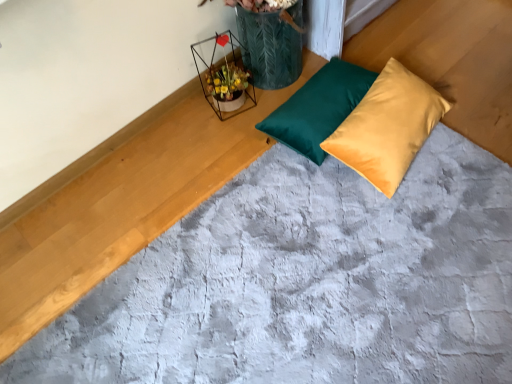
Where is `teal satin pillow at center, marked as the first pillow in a left-to-right arrangement`? This screenshot has width=512, height=384. teal satin pillow at center, marked as the first pillow in a left-to-right arrangement is located at coordinates (318, 108).

What is the approximate height of metallic wire flower basket at upper center?

It is 10.30 inches.

Locate an element on the screen. The width and height of the screenshot is (512, 384). teal satin pillow at center, which is the second pillow in right-to-left order is located at coordinates click(x=318, y=108).

Between metallic wire flower basket at upper center and satin yellow pillow at center, which appears as the 1th pillow when viewed from the right, which one has smaller size?

metallic wire flower basket at upper center.

Is metallic wire flower basket at upper center positioned before satin yellow pillow at center, which appears as the 1th pillow when viewed from the right?

No.

Identify the location of flower basket on the left side of satin yellow pillow at center, which appears as the 1th pillow when viewed from the right. (224, 75).

Based on the photo, could you measure the distance between metallic wire flower basket at upper center and satin yellow pillow at center, the second pillow when ordered from left to right?

A distance of 22.11 inches exists between metallic wire flower basket at upper center and satin yellow pillow at center, the second pillow when ordered from left to right.

Between teal satin pillow at center, which is the second pillow in right-to-left order, and satin yellow pillow at center, the second pillow when ordered from left to right, which one has larger width?

satin yellow pillow at center, the second pillow when ordered from left to right, is wider.

Could you tell me if teal satin pillow at center, marked as the first pillow in a left-to-right arrangement, is facing satin yellow pillow at center, which appears as the 1th pillow when viewed from the right?

Yes, teal satin pillow at center, marked as the first pillow in a left-to-right arrangement, is facing satin yellow pillow at center, which appears as the 1th pillow when viewed from the right.

Is teal satin pillow at center, which is the second pillow in right-to-left order, bigger than satin yellow pillow at center, the second pillow when ordered from left to right?

No.

Considering the positions of points (332, 62) and (377, 141), is point (332, 62) farther from camera compared to point (377, 141)?

Yes, point (332, 62) is farther from viewer.

From a real-world perspective, between teal satin pillow at center, which is the second pillow in right-to-left order, and metallic wire flower basket at upper center, who is vertically lower?

teal satin pillow at center, which is the second pillow in right-to-left order, from a real-world perspective.

Can you confirm if teal satin pillow at center, which is the second pillow in right-to-left order, is thinner than metallic wire flower basket at upper center?

Incorrect, the width of teal satin pillow at center, which is the second pillow in right-to-left order, is not less than that of metallic wire flower basket at upper center.

Is teal satin pillow at center, which is the second pillow in right-to-left order, directly adjacent to metallic wire flower basket at upper center?

teal satin pillow at center, which is the second pillow in right-to-left order, and metallic wire flower basket at upper center are not in contact.

Is teal satin pillow at center, marked as the first pillow in a left-to-right arrangement, oriented away from metallic wire flower basket at upper center?

Yes, metallic wire flower basket at upper center is at the back of teal satin pillow at center, marked as the first pillow in a left-to-right arrangement.

Looking at this image, from the image's perspective, is satin yellow pillow at center, the second pillow when ordered from left to right, located above teal satin pillow at center, marked as the first pillow in a left-to-right arrangement?

Incorrect, from the image's perspective, satin yellow pillow at center, the second pillow when ordered from left to right, is lower than teal satin pillow at center, marked as the first pillow in a left-to-right arrangement.

The width and height of the screenshot is (512, 384). There is a teal satin pillow at center, marked as the first pillow in a left-to-right arrangement. What are the coordinates of `pillow above it (from a real-world perspective)` in the screenshot? It's located at coord(388,127).

Are satin yellow pillow at center, the second pillow when ordered from left to right, and teal satin pillow at center, marked as the first pillow in a left-to-right arrangement, making contact?

satin yellow pillow at center, the second pillow when ordered from left to right, is not next to teal satin pillow at center, marked as the first pillow in a left-to-right arrangement, and they're not touching.

Between satin yellow pillow at center, which appears as the 1th pillow when viewed from the right, and teal satin pillow at center, which is the second pillow in right-to-left order, which one has larger size?

satin yellow pillow at center, which appears as the 1th pillow when viewed from the right.

Can you tell me how much satin yellow pillow at center, the second pillow when ordered from left to right, and metallic wire flower basket at upper center differ in facing direction?

The facing directions of satin yellow pillow at center, the second pillow when ordered from left to right, and metallic wire flower basket at upper center are 5.79 degrees apart.

Who is smaller, satin yellow pillow at center, which appears as the 1th pillow when viewed from the right, or metallic wire flower basket at upper center?

With smaller size is metallic wire flower basket at upper center.

Can you confirm if satin yellow pillow at center, which appears as the 1th pillow when viewed from the right, is positioned to the right of metallic wire flower basket at upper center?

Yes.

Considering the sizes of objects satin yellow pillow at center, which appears as the 1th pillow when viewed from the right, and metallic wire flower basket at upper center in the image provided, who is wider, satin yellow pillow at center, which appears as the 1th pillow when viewed from the right, or metallic wire flower basket at upper center?

satin yellow pillow at center, which appears as the 1th pillow when viewed from the right, is wider.

Considering the positions of objects metallic wire flower basket at upper center and teal satin pillow at center, which is the second pillow in right-to-left order, in the image provided, who is more to the right, metallic wire flower basket at upper center or teal satin pillow at center, which is the second pillow in right-to-left order,?

From the viewer's perspective, teal satin pillow at center, which is the second pillow in right-to-left order, appears more on the right side.

What are the coordinates of `pillow that is the 2nd object directly below the metallic wire flower basket at upper center (from a real-world perspective)` in the screenshot? It's located at (318, 108).

Between metallic wire flower basket at upper center and teal satin pillow at center, marked as the first pillow in a left-to-right arrangement, which one has less height?

teal satin pillow at center, marked as the first pillow in a left-to-right arrangement.

Which of these two, metallic wire flower basket at upper center or teal satin pillow at center, which is the second pillow in right-to-left order, is smaller?

With smaller size is metallic wire flower basket at upper center.

Starting from the metallic wire flower basket at upper center, which pillow is the 2nd one in front? Please provide its 2D coordinates.

[(388, 127)]

Identify the location of pillow that is behind the satin yellow pillow at center, which appears as the 1th pillow when viewed from the right. The image size is (512, 384). (318, 108).

Which object lies nearer to the anchor point metallic wire flower basket at upper center, teal satin pillow at center, marked as the first pillow in a left-to-right arrangement, or satin yellow pillow at center, the second pillow when ordered from left to right?

The object closer to metallic wire flower basket at upper center is teal satin pillow at center, marked as the first pillow in a left-to-right arrangement.

When comparing their distances from satin yellow pillow at center, which appears as the 1th pillow when viewed from the right, does metallic wire flower basket at upper center or teal satin pillow at center, which is the second pillow in right-to-left order, seem further?

metallic wire flower basket at upper center.

From the image, which object appears to be nearer to metallic wire flower basket at upper center, satin yellow pillow at center, the second pillow when ordered from left to right, or teal satin pillow at center, marked as the first pillow in a left-to-right arrangement?

The object closer to metallic wire flower basket at upper center is teal satin pillow at center, marked as the first pillow in a left-to-right arrangement.

Which object lies nearer to the anchor point teal satin pillow at center, which is the second pillow in right-to-left order, metallic wire flower basket at upper center or satin yellow pillow at center, the second pillow when ordered from left to right?

satin yellow pillow at center, the second pillow when ordered from left to right, is closer to teal satin pillow at center, which is the second pillow in right-to-left order.

Looking at the image, which one is located further to teal satin pillow at center, marked as the first pillow in a left-to-right arrangement, satin yellow pillow at center, the second pillow when ordered from left to right, or metallic wire flower basket at upper center?

metallic wire flower basket at upper center is further to teal satin pillow at center, marked as the first pillow in a left-to-right arrangement.

From the image, which object appears to be farther from satin yellow pillow at center, which appears as the 1th pillow when viewed from the right, teal satin pillow at center, which is the second pillow in right-to-left order, or metallic wire flower basket at upper center?

metallic wire flower basket at upper center.

Locate an element on the screen. pillow situated between metallic wire flower basket at upper center and satin yellow pillow at center, the second pillow when ordered from left to right, from left to right is located at coordinates (318, 108).